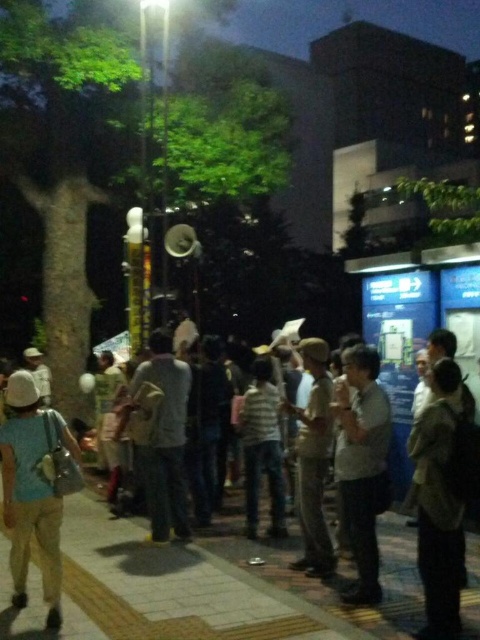
You are a photographer trying to capture a candid shot of the light gray shirt at center and the khaki fabric pants at center in the nighttime scene. Since you want to ensure both subjects are fully visible in the frame, which subject should you focus on first to account for their height difference?

The light gray shirt at center is not as tall as the khaki fabric pants at center, so you should focus on the khaki fabric pants at center first to ensure its full height is captured in the frame.

Consider the image. You are standing at the point with coordinates point (x=302, y=496) and want to walk towards the streetlamp. There is a point marked at point (x=346, y=397). Is this point in front of or behind you relative to your direction of movement?

The point (x=346, y=397) is in front of point (x=302, y=496), so it is in front of you as you walk towards the streetlamp.

You are a photographer trying to capture a candid shot of both the dark brown leather jacket at lower right and the light blue fabric shirt at lower left in the same frame. Given their sizes, which one might appear closer to the camera in the final photo?

The dark brown leather jacket at lower right has a smaller size compared to the light blue fabric shirt at lower left. In photography, objects that are smaller in the frame typically appear farther away from the camera. Therefore, the light blue fabric shirt at lower left, being larger, would appear closer to the camera in the photo.